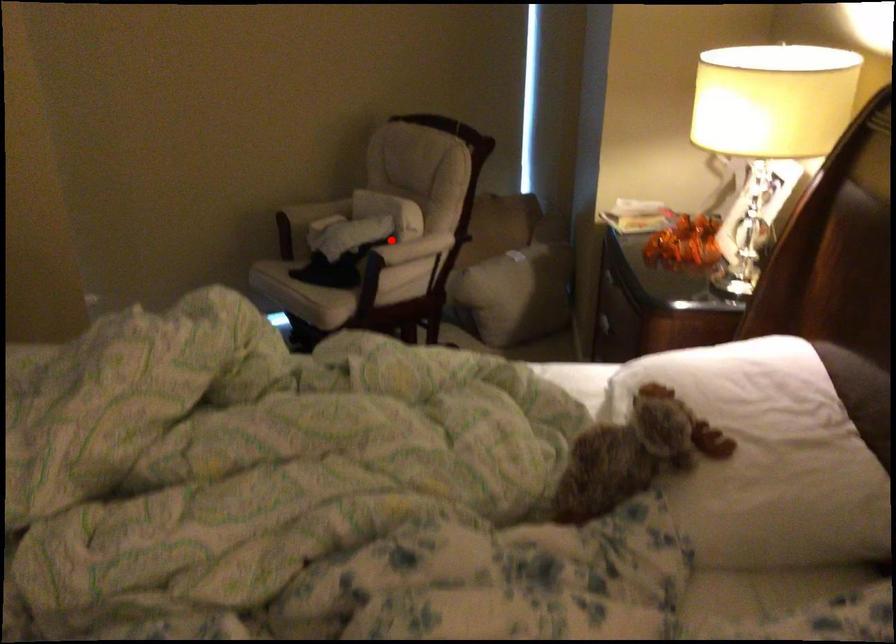
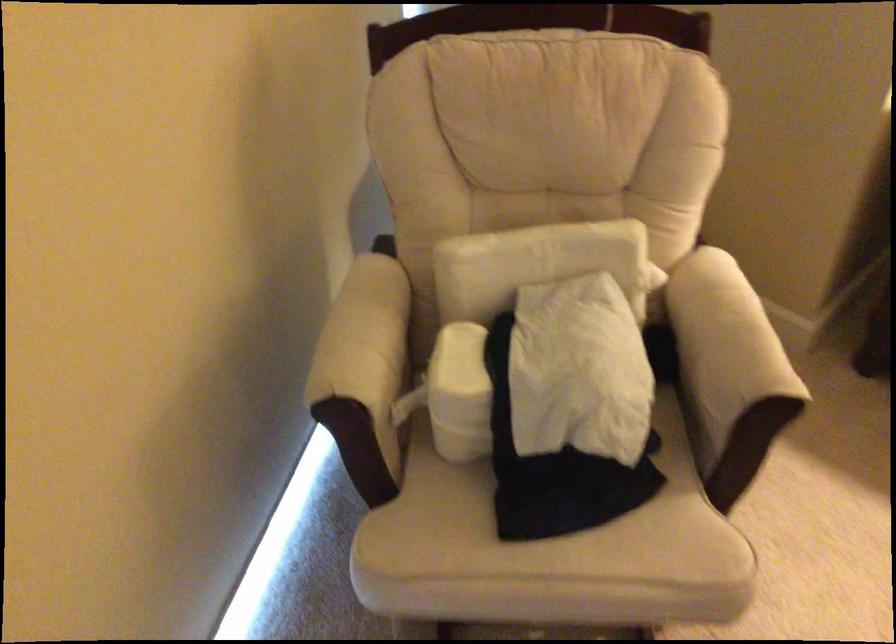
Question: I am providing you with two images of the same scene from different viewpoints. In image1, a red point is highlighted. Considering the same 3D point in image2, which of the following is correct?

Choices:
 (A) It is closer
 (B) It is farther

Answer: (A)